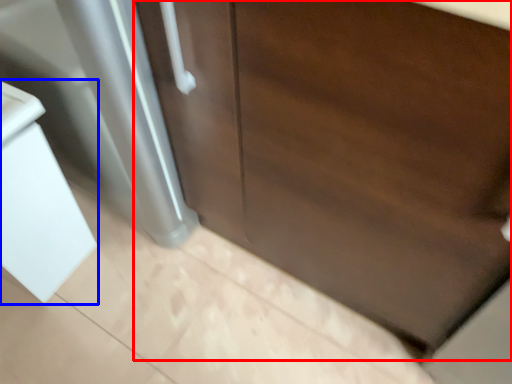
Question: Which object is further to the camera taking this photo, door (highlighted by a red box) or sink (highlighted by a blue box)?

Choices:
 (A) door
 (B) sink

Answer: (B)